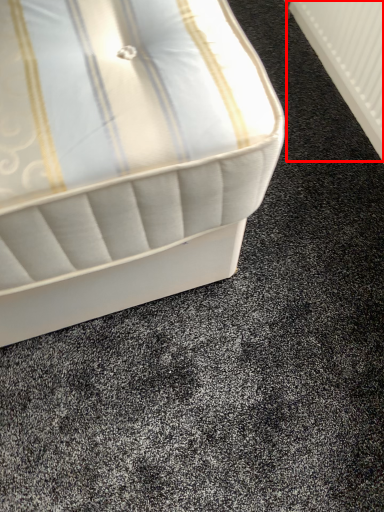
Question: Where is radiator (annotated by the red box) located in relation to bed in the image?

Choices:
 (A) left
 (B) right

Answer: (B)